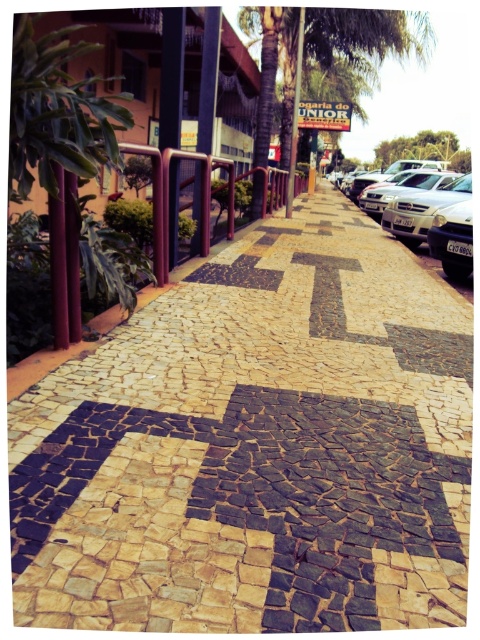
You are standing on the sidewalk in the urban street scene. You see two points marked on the ground. One is at coordinate point (x=351, y=396) and the other is at point (x=315, y=38). Which point is closer to you?

Point (x=351, y=396) is closer to the viewer than point (x=315, y=38).

You are standing on the sidewalk and want to take a photo of both the natural stone mosaic at center and the green leafy palm tree at upper center. Which object should you focus on first to ensure both are in clear view?

You should focus on the natural stone mosaic at center first since it is closer to you, and then adjust the focus to include the green leafy palm tree at upper center in the background.

You are a photographer standing on the sidewalk and want to capture both the green leafy palm tree at upper center and the silver metallic car at right in a single shot. Which object should you focus on first to ensure both are in frame?

You should focus on the green leafy palm tree at upper center first because it is larger in size than the silver metallic car at right, so it will take up more space in the frame and help you position both elements effectively.